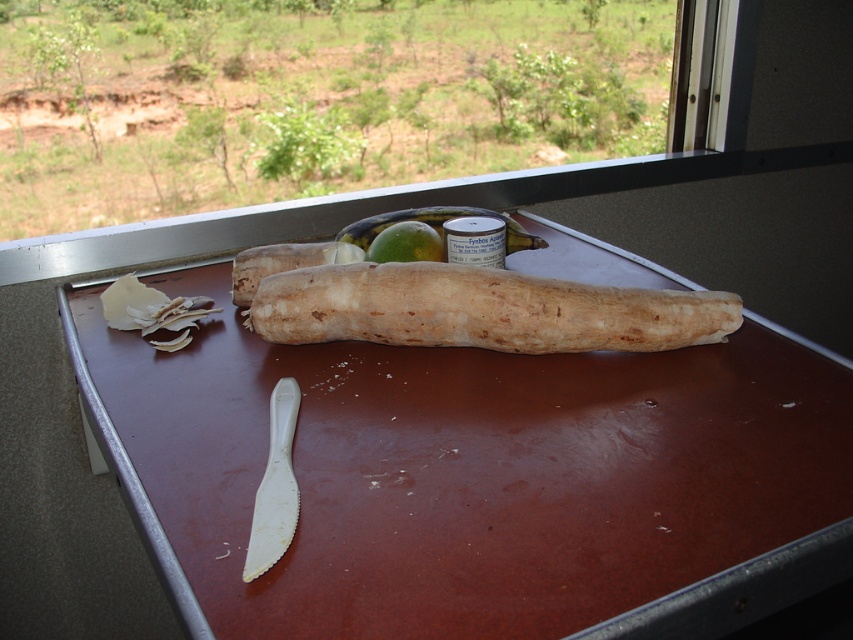
You are organizing items on the brown matte table at center and need to place the brown rough textured root vegetable at center on it. Considering the table and vegetable dimensions, can the vegetable be placed horizontally without overhanging the table edges?

The brown matte table at center is wider than the brown rough textured root vegetable at center, so yes, the vegetable can be placed horizontally without overhanging the table edges.

You are organizing items on the table and need to place a new object. Considering the brown matte table at center and the green matte apple at center, which object can accommodate a larger item in terms of size?

The brown matte table at center is bigger than the green matte apple at center, so it can accommodate a larger item.